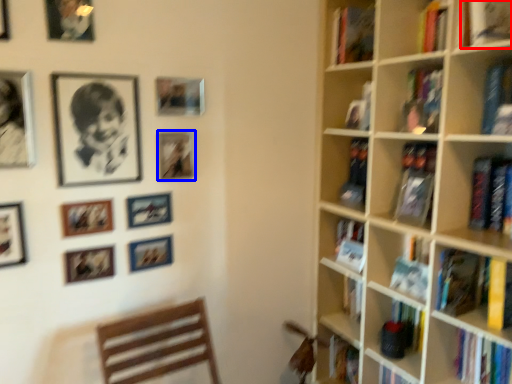
Question: Which object is closer to the camera taking this photo, book (highlighted by a red box) or picture frame (highlighted by a blue box)?

Choices:
 (A) book
 (B) picture frame

Answer: (A)